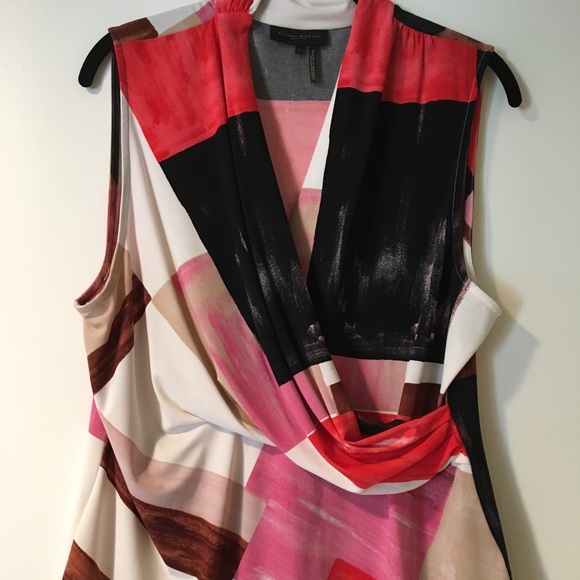
The image size is (580, 580). I want to click on pink fabric, so click(200, 90), click(404, 84), click(257, 376), click(300, 510), click(288, 151).